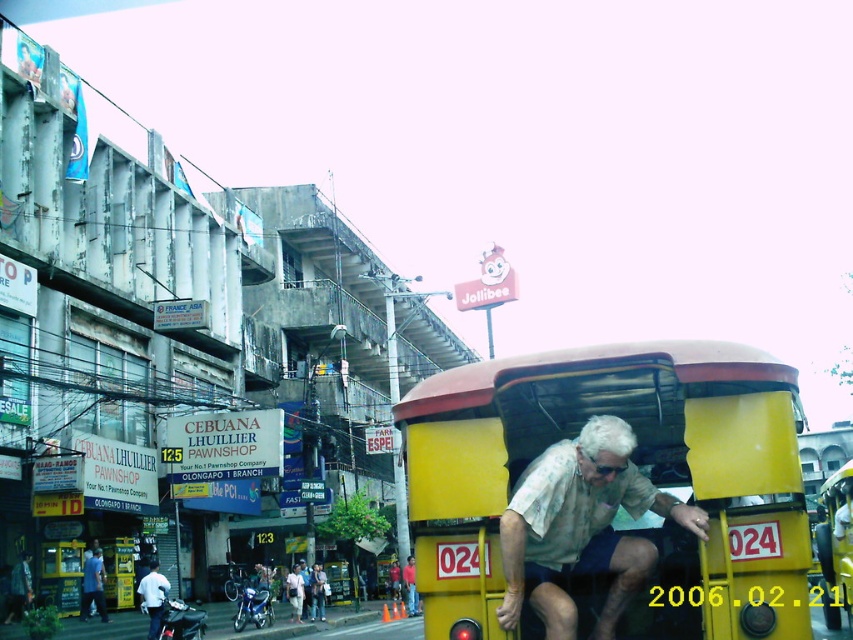
You are a photographer trying to capture a photo of the white matte coach at lower left and the light blue shirt at lower left. If you want to ensure both are fully visible in your frame, which object should you prioritize positioning closer to the edge of the frame to avoid cropping?

The white matte coach at lower left might be wider than the light blue shirt at lower left, so you should prioritize positioning the light blue shirt at lower left closer to the edge of the frame to ensure the wider white matte coach at lower left fits entirely within the frame.

You are a delivery rider who needs to park your vehicle between the blue metallic motorcycle at lower left and the light brown leather jacket at lower center. Which side should you park on to ensure there is enough space for your vehicle?

The blue metallic motorcycle at lower left might be wider than the light brown leather jacket at lower center, so you should park your vehicle on the side of the light brown leather jacket at lower center to ensure there is enough space.